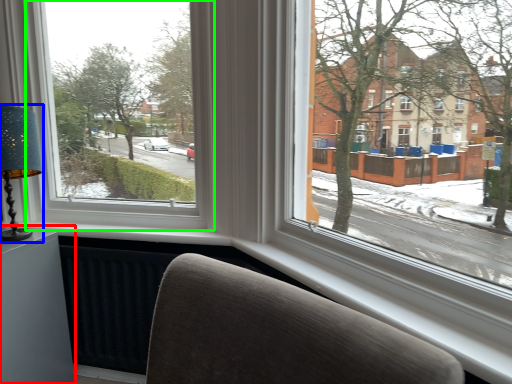
Question: Considering the real-world distances, which object is farthest from table (highlighted by a red box)? table lamp (highlighted by a blue box) or window (highlighted by a green box)?

Choices:
 (A) table lamp
 (B) window

Answer: (B)